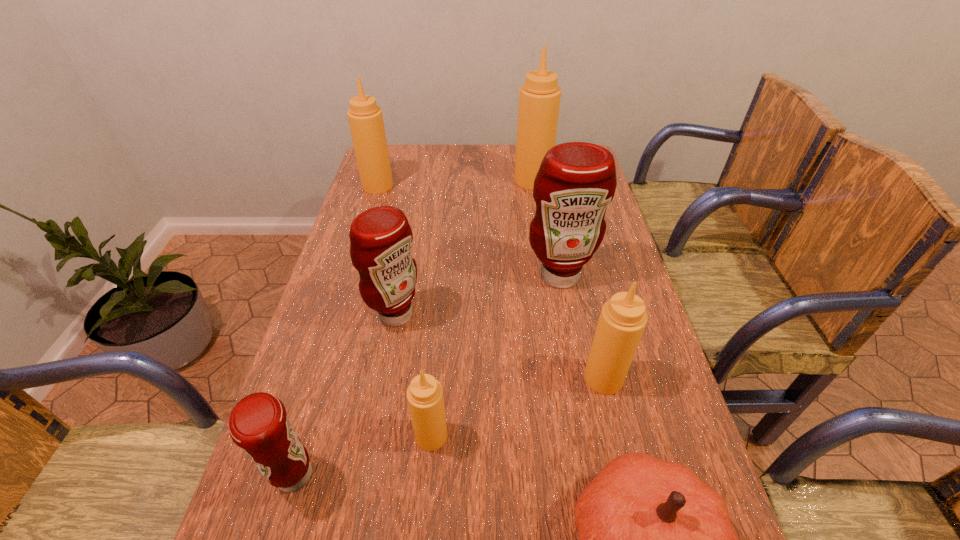
Locate an element on the screen. Image resolution: width=960 pixels, height=540 pixels. object present at the far edge is located at coordinates (539, 99).

You are a GUI agent. You are given a task and a screenshot of the screen. Output one action in this format:
    pyautogui.click(x=<x>, y=<y>)
    Task: Click on the vacant region at the far edge of the desktop
    
    Given the screenshot: What is the action you would take?
    pyautogui.click(x=422, y=144)

The width and height of the screenshot is (960, 540). In the image, there is a desktop. What are the coordinates of `blank space at the left edge` in the screenshot? It's located at (371, 339).

Locate an element on the screen. free spot at the right edge of the desktop is located at coordinates (610, 253).

You are a GUI agent. You are given a task and a screenshot of the screen. Output one action in this format:
    pyautogui.click(x=<x>, y=<y>)
    Task: Click on the vacant space at the far left corner of the desktop
    
    Given the screenshot: What is the action you would take?
    (x=391, y=155)

Find the location of a particular element. free point between the leftmost tan condiment and the biggest red condiment is located at coordinates (468, 231).

This screenshot has height=540, width=960. I want to click on free space between the rightmost red condiment and the fifth farthest object, so click(582, 327).

Image resolution: width=960 pixels, height=540 pixels. Identify the location of unoccupied area between the fourth condiment from left to right and the biggest tan condiment. (482, 308).

Find the location of a particular element. The image size is (960, 540). vacant region between the third tan condiment from right to left and the second nearest tan condiment is located at coordinates (517, 407).

Image resolution: width=960 pixels, height=540 pixels. Find the location of `free space between the leftmost red condiment and the second nearest tan condiment`. free space between the leftmost red condiment and the second nearest tan condiment is located at coordinates (449, 427).